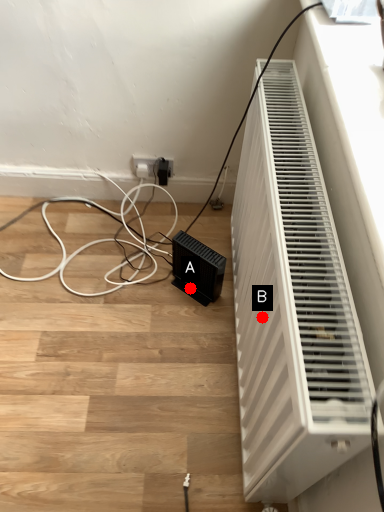
Question: Two points are circled on the image, labeled by A and B beside each circle. Which point is closer to the camera?

Choices:
 (A) A is closer
 (B) B is closer

Answer: (B)